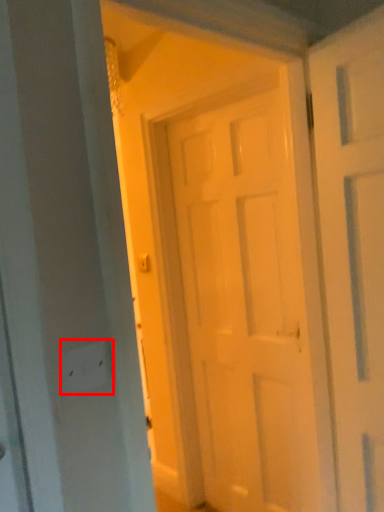
Question: In this image, where is electric outlet (annotated by the red box) located relative to door?

Choices:
 (A) left
 (B) right

Answer: (A)